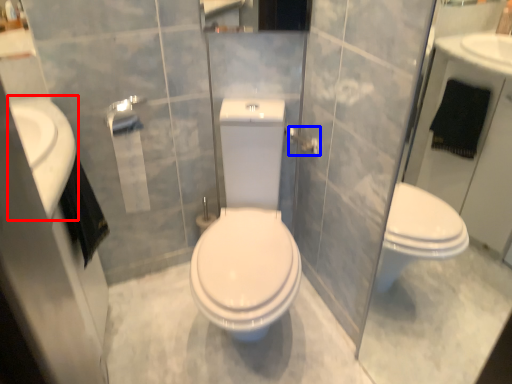
Question: Which object is further to the camera taking this photo, sink (highlighted by a red box) or towel bar (highlighted by a blue box)?

Choices:
 (A) sink
 (B) towel bar

Answer: (B)